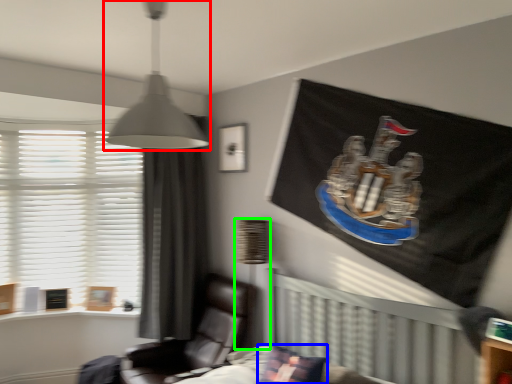
Question: Which object is positioned farthest from lamp (highlighted by a red box)? Select from pillow (highlighted by a blue box) and table lamp (highlighted by a green box).

Choices:
 (A) pillow
 (B) table lamp

Answer: (B)